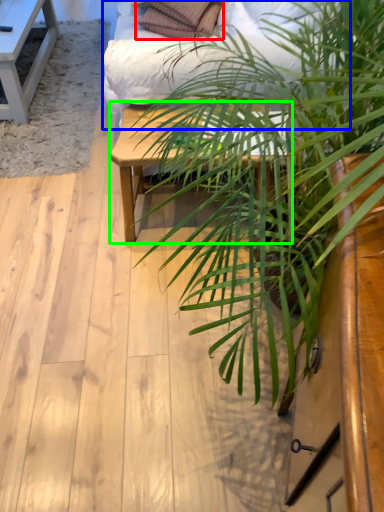
Question: Which object is the closest to the pillow (highlighted by a red box)? Choose among these: bed frame (highlighted by a blue box) or table (highlighted by a green box).

Choices:
 (A) bed frame
 (B) table

Answer: (A)